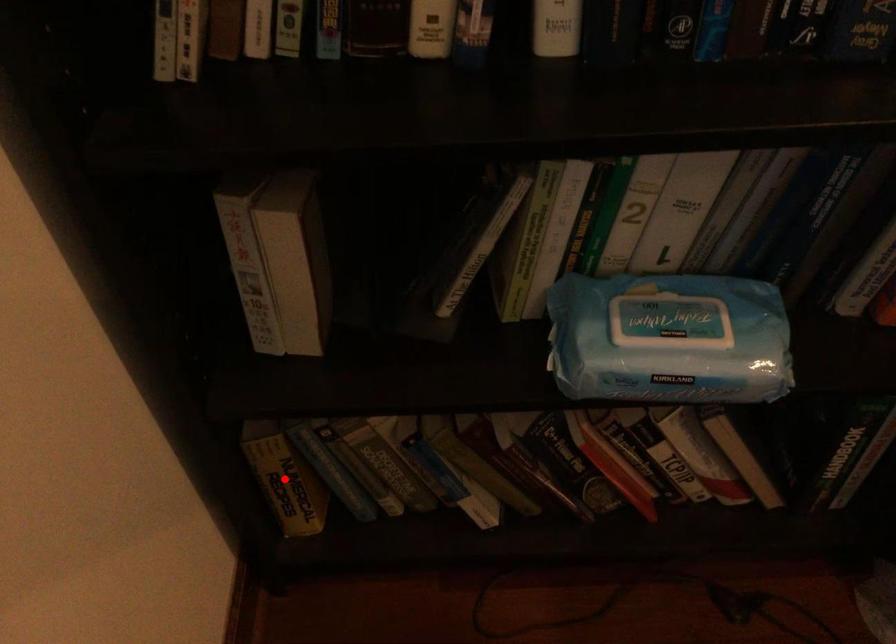
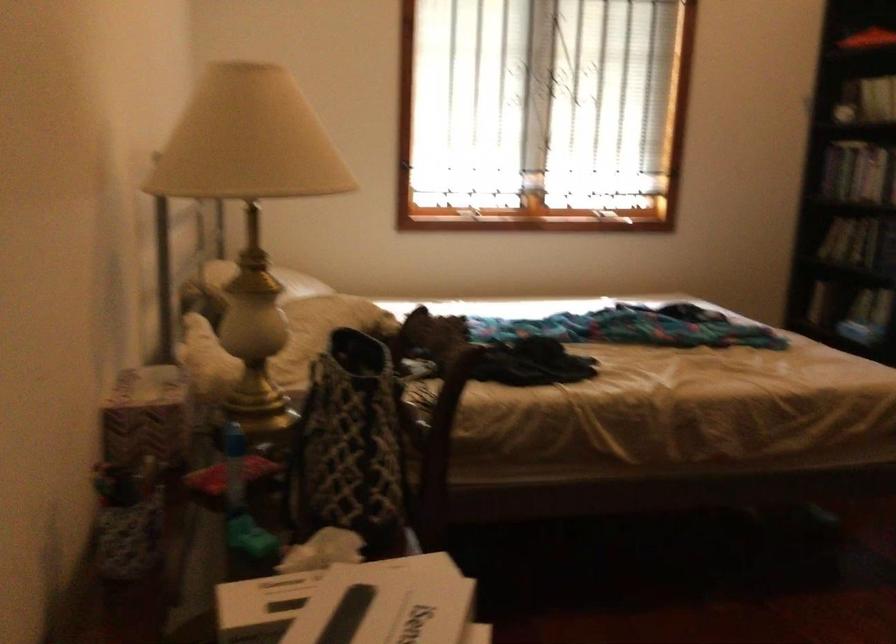
Question: I am providing you with two images of the same scene from different viewpoints. A red point is marked on the first image. Is the red point's position out of view in image 2?

Choices:
 (A) Yes
 (B) No

Answer: (A)